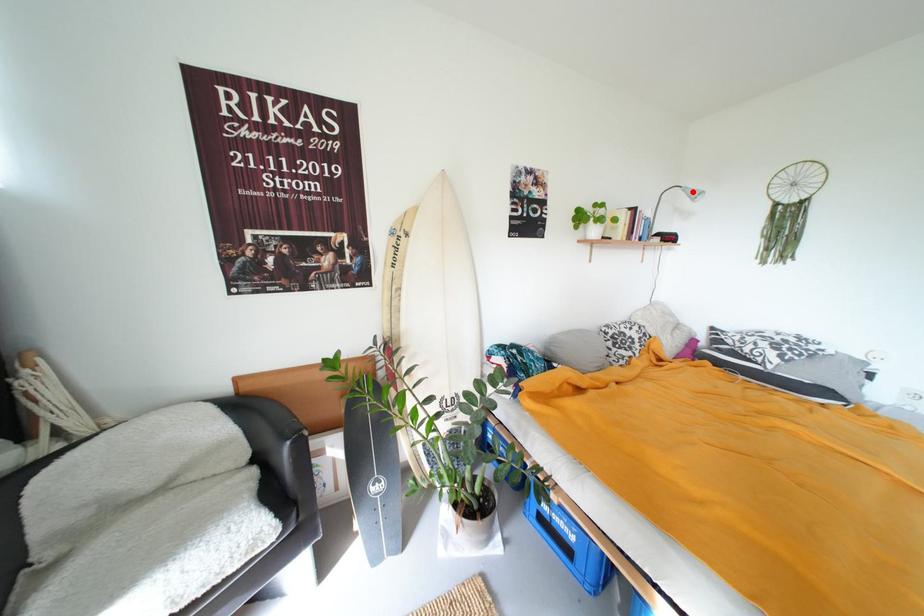
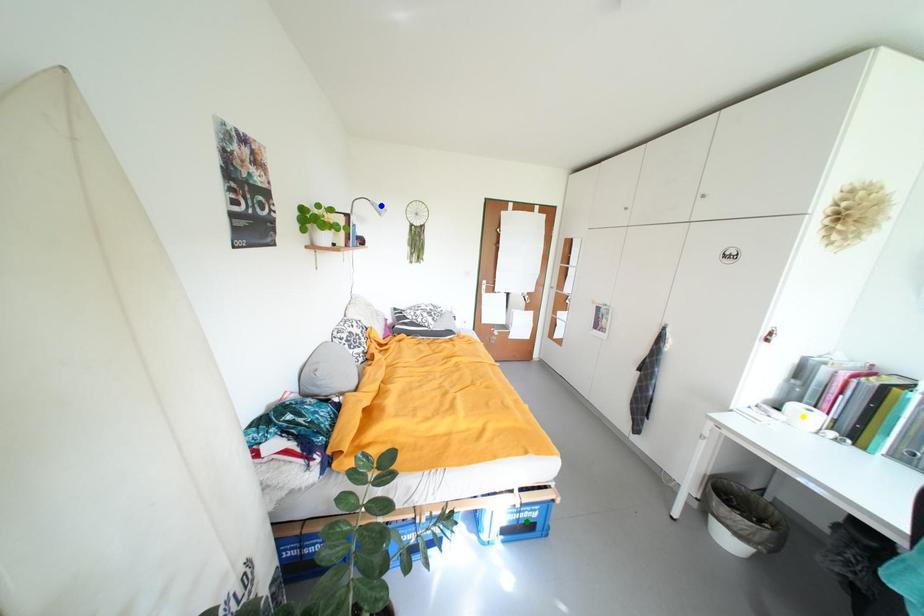
Question: I am providing you with two images of the same scene from different viewpoints. A red point is marked on the first image. You are given multiple points on the second image. In image 2, which mark is for the same physical point as the one in image 1?

Choices:
 (A) yellow point
 (B) green point
 (C) blue point

Answer: (C)